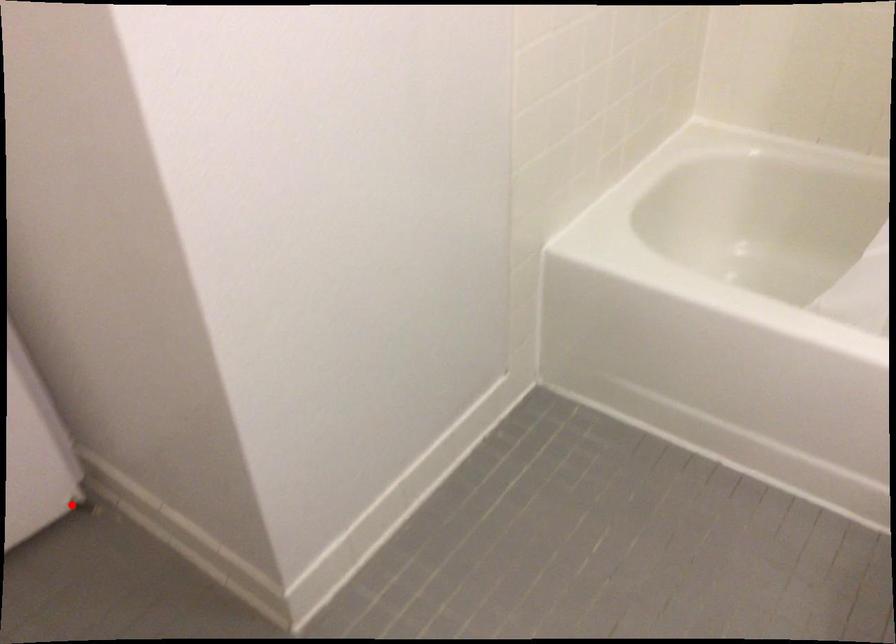
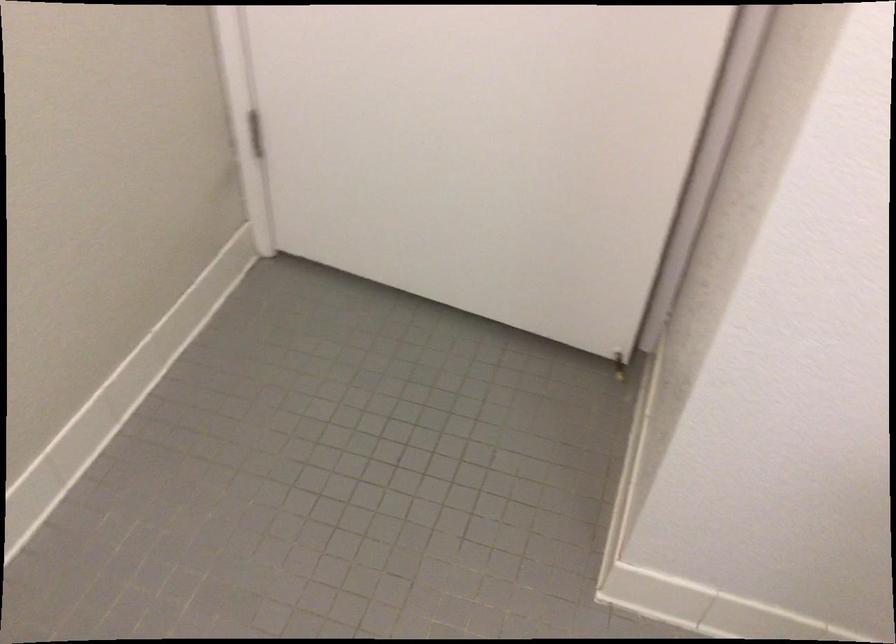
Locate, in the second image, the point that corresponds to the highlighted location in the first image.

(618, 366)